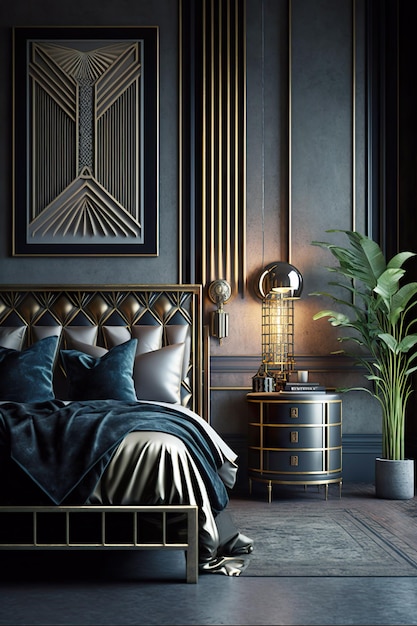
Find the location of `sheet`. sheet is located at coordinates (159, 463), (225, 563), (237, 540), (220, 444), (65, 402).